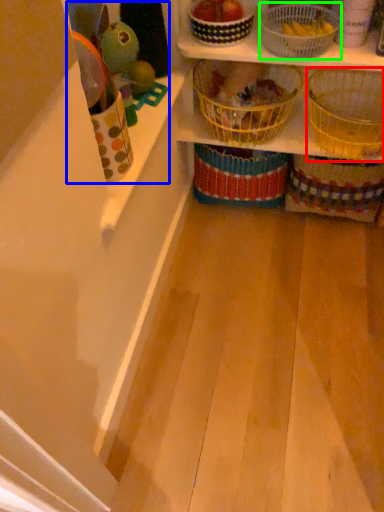
Question: Estimate the real-world distances between objects in this image. Which object is farther from basket (highlighted by a red box), toy (highlighted by a blue box) or basket (highlighted by a green box)?

Choices:
 (A) toy
 (B) basket

Answer: (A)